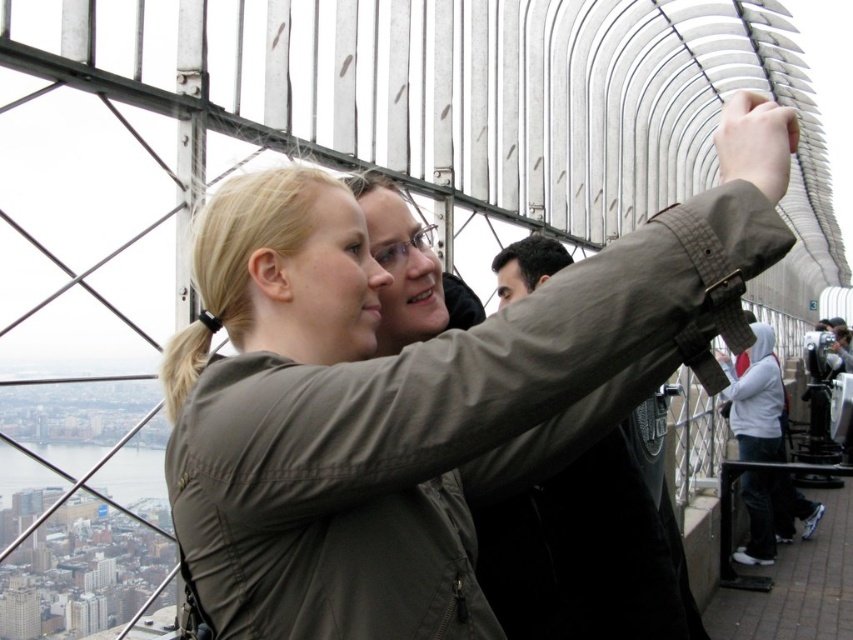
You are standing on the observation deck and want to take a photo that includes both the point at coordinates point (308,321) and the point at coordinates point (653,534). Which point is closer to you and should be framed first?

The point at coordinates point (308,321) is closer to the viewer than point (653,534), so you should frame it first to ensure both points are in the shot.

You are standing on the observation deck and want to take a photo of the cityscape. There is a point at coordinates point (366, 515) that you want to include in your shot. Given that the distance from this point to you is 641.87 meters, will this point be visible in your photo if your camera has a maximum focus range of 600 meters?

The point at coordinates point (366, 515) is 641.87 meters away from you, which exceeds your camera maximum focus range of 600 meters. Therefore, the point will not be visible in your photo.